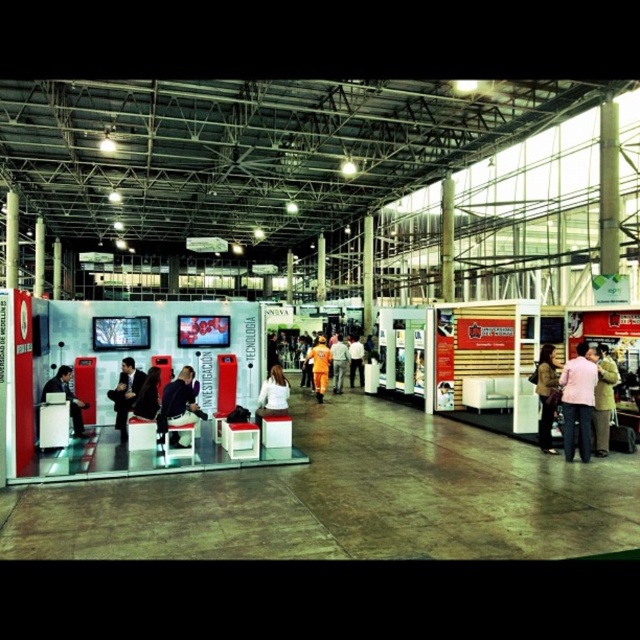
You are an event organizer who needs to decide which item to move first to free up space. Based on their sizes, which item should you move first between the matte black jacket at center and the dark suit at center?

The matte black jacket at center is bigger than the dark suit at center, so you should move the matte black jacket at center first to free up more space.

You are at the exhibition and want to compare the sizes of two jackets displayed at the booth. The pink fabric jacket at right and the orange fabric jacket at center are both on display. Which jacket is larger?

The orange fabric jacket at center is larger than the pink fabric jacket at right.